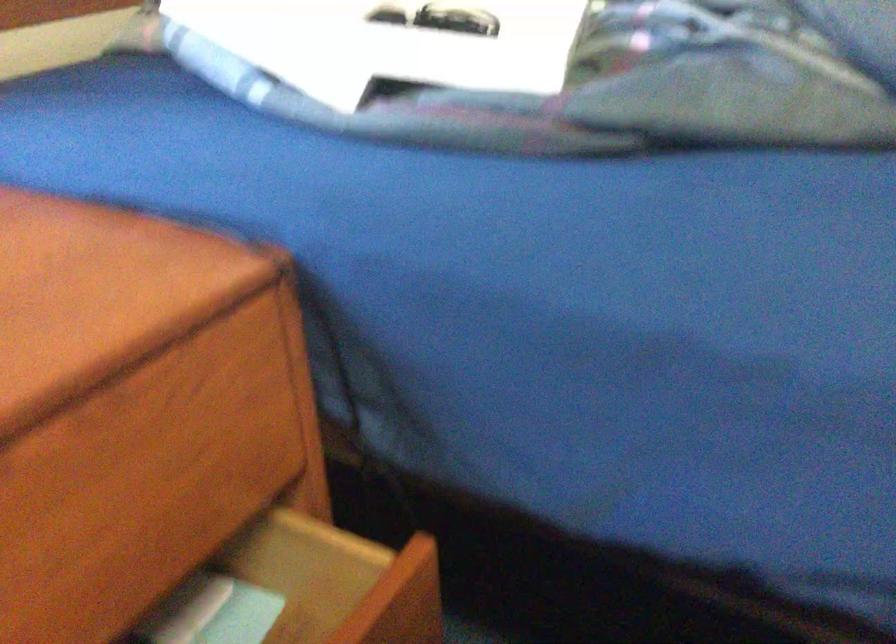
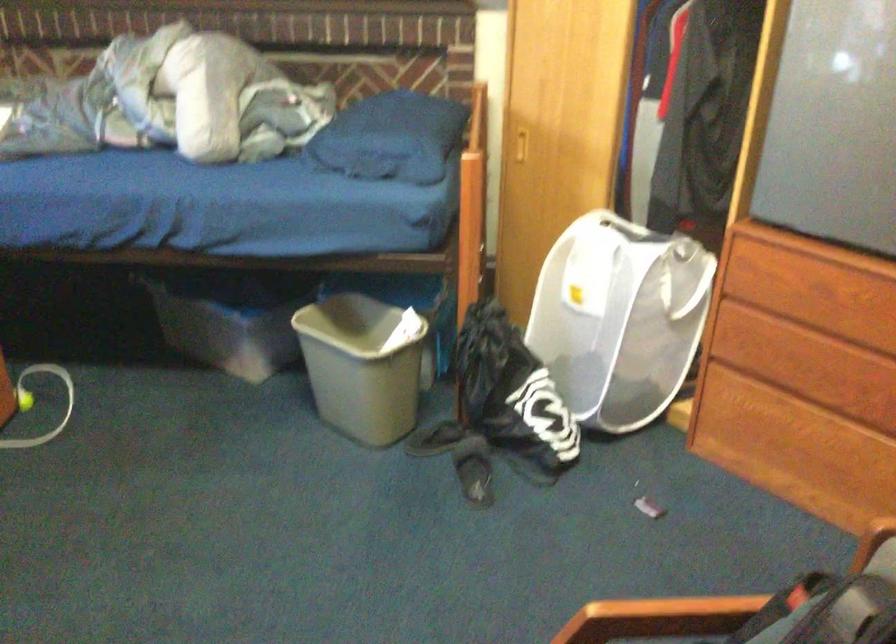
Question: Which direction would the cameraman need to move to produce the second image? Reply with the corresponding letter.

Choices:
 (A) Left
 (B) Right
 (C) Forward
 (D) Backward

Answer: (D)